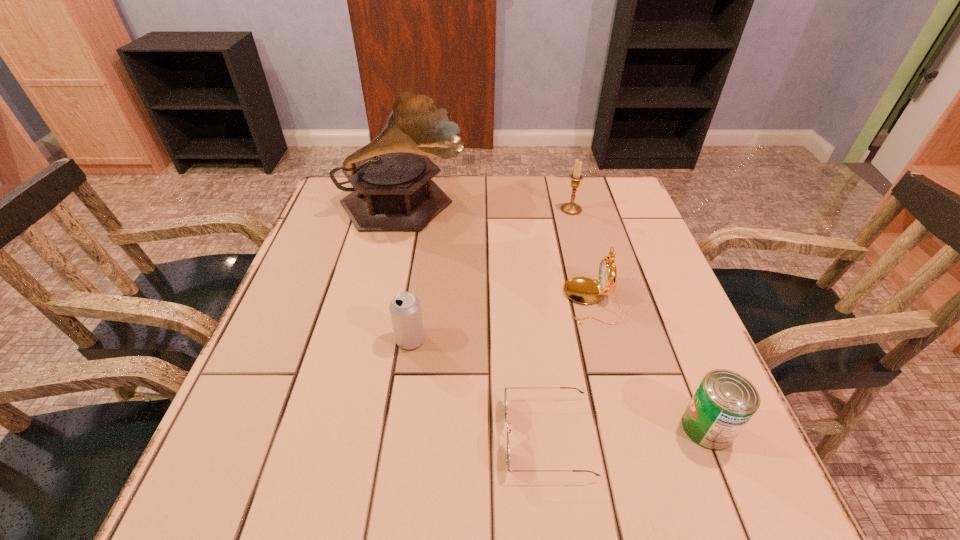
Where is `free spot located on the face of the pocket watch`? This screenshot has height=540, width=960. free spot located on the face of the pocket watch is located at coordinates (534, 301).

Locate an element on the screen. The width and height of the screenshot is (960, 540). free space located 0.120m on the face of the pocket watch is located at coordinates (511, 301).

You are a GUI agent. You are given a task and a screenshot of the screen. Output one action in this format:
    pyautogui.click(x=<x>, y=<y>)
    Task: Click on the free point located 0.400m on the right of the beer can
    
    Given the screenshot: What is the action you would take?
    pyautogui.click(x=622, y=340)

In order to click on vacant area situated on the back of the rightmost object in this screenshot , I will do coord(669,332).

This screenshot has height=540, width=960. In order to click on vacant space situated on the front-facing side of the fourth object from right to left in this screenshot , I will do `click(299, 436)`.

Image resolution: width=960 pixels, height=540 pixels. In order to click on free space located 0.350m on the front-facing side of the fourth object from right to left in this screenshot , I will do `click(299, 436)`.

This screenshot has width=960, height=540. What are the coordinates of `vacant space positioned 0.230m on the front-facing side of the fourth object from right to left` in the screenshot? It's located at (370, 436).

The image size is (960, 540). In order to click on phonograph record present at the far edge in this screenshot , I will do `click(393, 190)`.

I want to click on candle holder that is positioned at the far edge, so click(x=571, y=208).

At what (x,y) coordinates should I click in order to perform the action: click on object that is at the near edge. Please return your answer as a coordinate pair (x, y). This screenshot has height=540, width=960. Looking at the image, I should click on (505, 394).